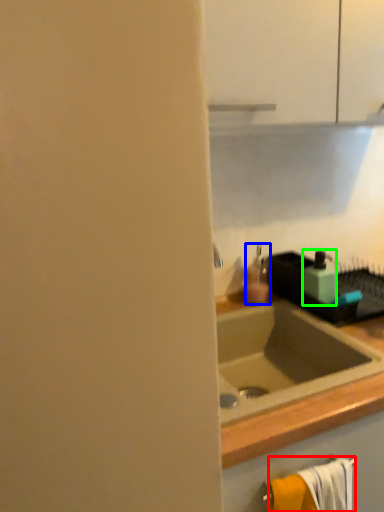
Question: Which object is positioned closest to bath towel (highlighted by a red box)? Select from soap dispenser (highlighted by a blue box) and soap dispenser (highlighted by a green box).

Choices:
 (A) soap dispenser
 (B) soap dispenser

Answer: (B)